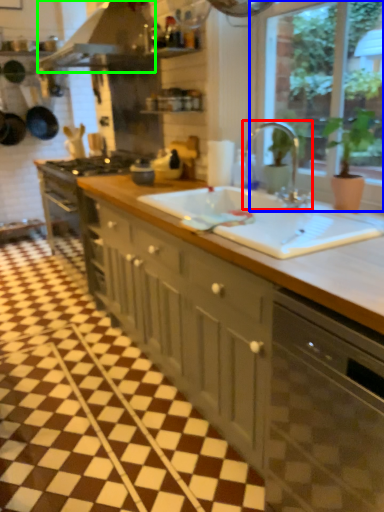
Question: Which is farther away from tap (highlighted by a red box)? window (highlighted by a blue box) or exhaust hood (highlighted by a green box)?

Choices:
 (A) window
 (B) exhaust hood

Answer: (B)